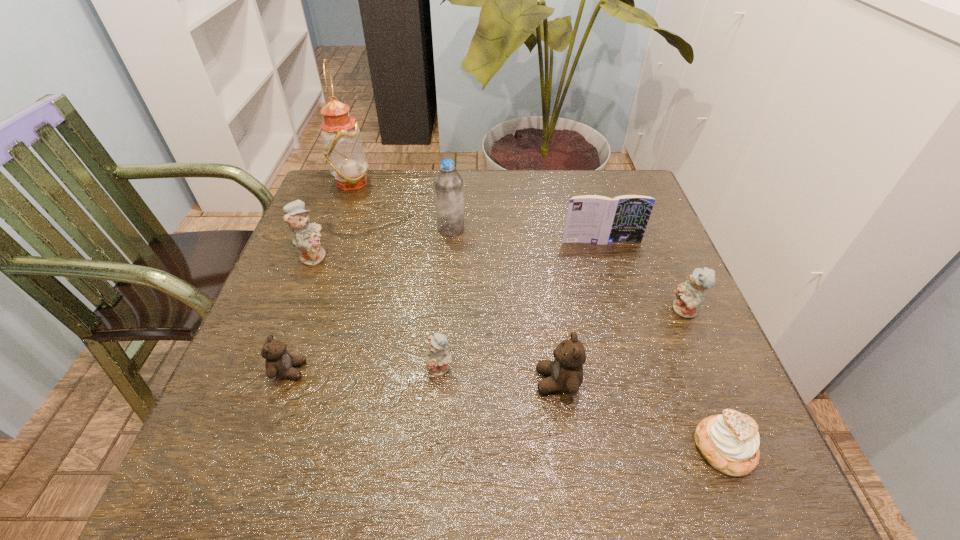
Identify the location of vacant area situated on the front-facing side of the second nearest blue teddy bear. (577, 310).

Find the location of a particular element. vacant space situated on the front-facing side of the second nearest blue teddy bear is located at coordinates (582, 310).

The height and width of the screenshot is (540, 960). What are the coordinates of `free space located 0.060m on the face of the right brown teddy bear` in the screenshot? It's located at (503, 381).

I want to click on blank space located 0.310m on the face of the right brown teddy bear, so click(x=367, y=381).

Find the location of a particular element. The width and height of the screenshot is (960, 540). vacant space located 0.110m on the face of the right brown teddy bear is located at coordinates (475, 381).

Locate an element on the screen. vacant space located on the face of the smaller brown teddy bear is located at coordinates (503, 370).

You are a GUI agent. You are given a task and a screenshot of the screen. Output one action in this format:
    pyautogui.click(x=<x>, y=<y>)
    Task: Click on the free point located on the front-facing side of the smallest blue teddy bear
    This screenshot has height=540, width=960.
    Given the screenshot: What is the action you would take?
    pyautogui.click(x=431, y=491)

The height and width of the screenshot is (540, 960). I want to click on free spot located on the back of the nearest object, so point(658,282).

Locate an element on the screen. This screenshot has width=960, height=540. oil lamp present at the far edge is located at coordinates (343, 148).

Image resolution: width=960 pixels, height=540 pixels. Find the location of `water bottle at the far edge`. water bottle at the far edge is located at coordinates (449, 198).